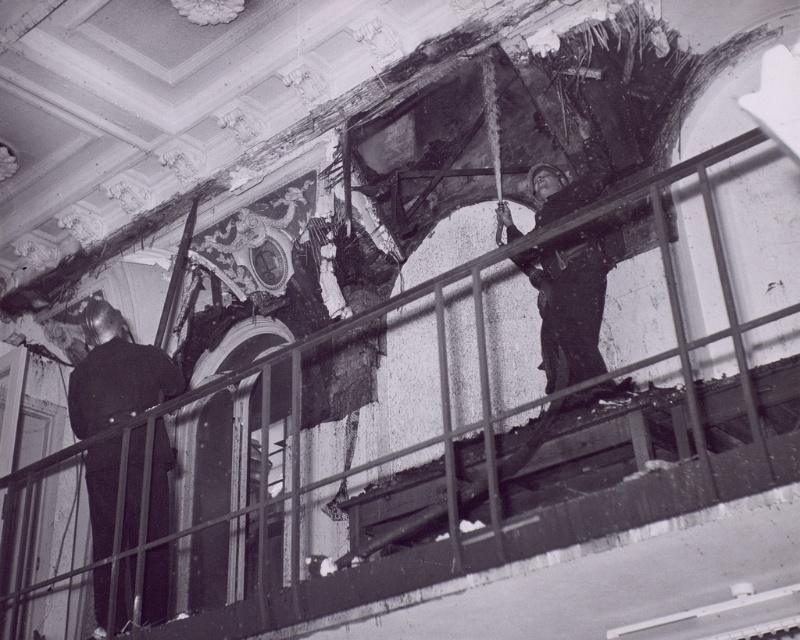
Locate an element on the screen. This screenshot has height=640, width=800. dark fabric uniform at left is located at coordinates (114, 372).

The image size is (800, 640). I want to click on dark fabric uniform at left, so click(114, 372).

Locate an element on the screen. dark fabric uniform at left is located at coordinates (114, 372).